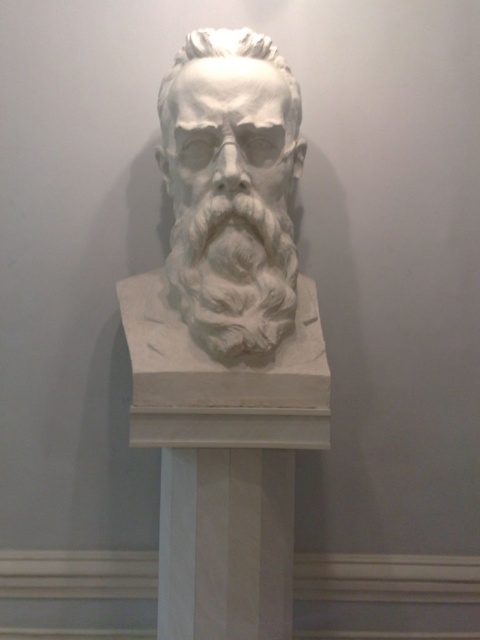
Measure the distance between point [236,448] and camera.

Point [236,448] and camera are 5.47 feet apart.

Which is behind, point (186, 632) or point (202, 561)?

Point (186, 632)

Who is more forward, (190, 138) or (204, 564)?

Point (204, 564) is in front.

Where is `white marble bust at center`? This screenshot has height=640, width=480. white marble bust at center is located at coordinates (227, 340).

Who is shorter, white marble bust at center or white stone beard at center?

With less height is white stone beard at center.

Is white marble bust at center in front of white stone beard at center?

That is True.

Is point (247, 360) farther from camera compared to point (277, 337)?

That is False.

Locate an element on the screen. Image resolution: width=480 pixels, height=640 pixels. white marble bust at center is located at coordinates (227, 340).

Based on the photo, who is positioned more to the left, white marble pedestal at center or white stone beard at center?

From the viewer's perspective, white marble pedestal at center appears more on the left side.

Measure the distance between white marble pedestal at center and camera.

white marble pedestal at center is 1.69 meters away from camera.

At what (x,y) coordinates should I click in order to perform the action: click on white marble pedestal at center. Please return your answer as a coordinate pair (x, y). The height and width of the screenshot is (640, 480). Looking at the image, I should click on (226, 544).